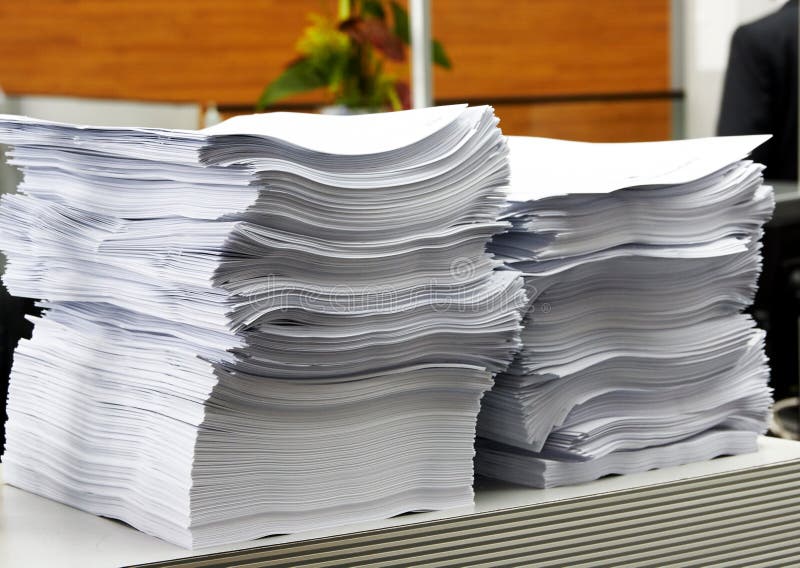
Find the location of `table side`. table side is located at coordinates (722, 542).